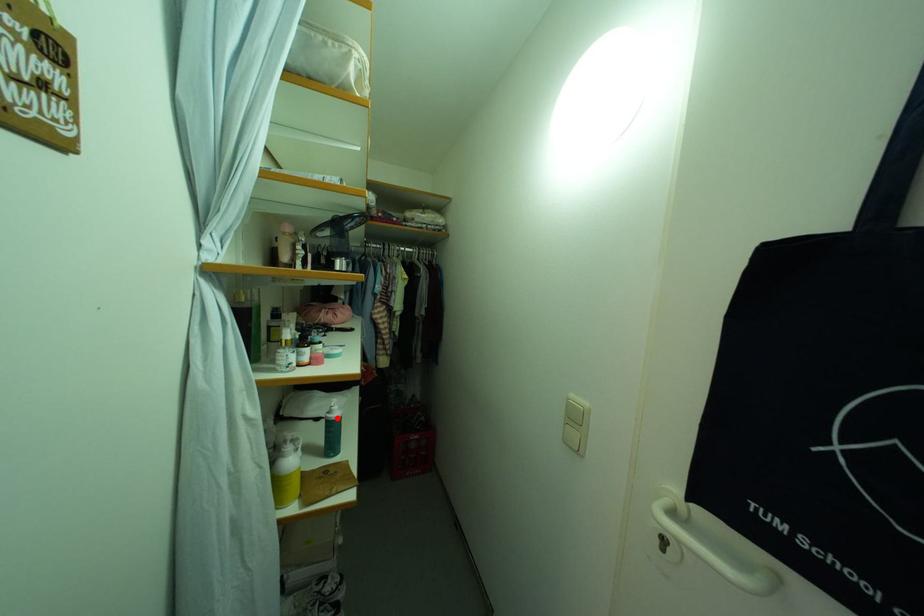
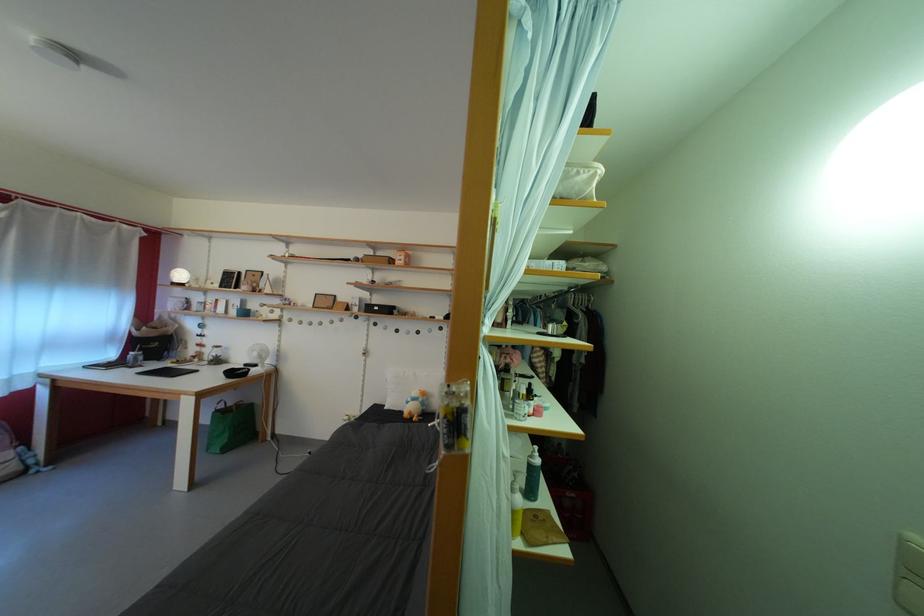
In the second image, find the point that corresponds to the highlighted location in the first image.

(540, 463)